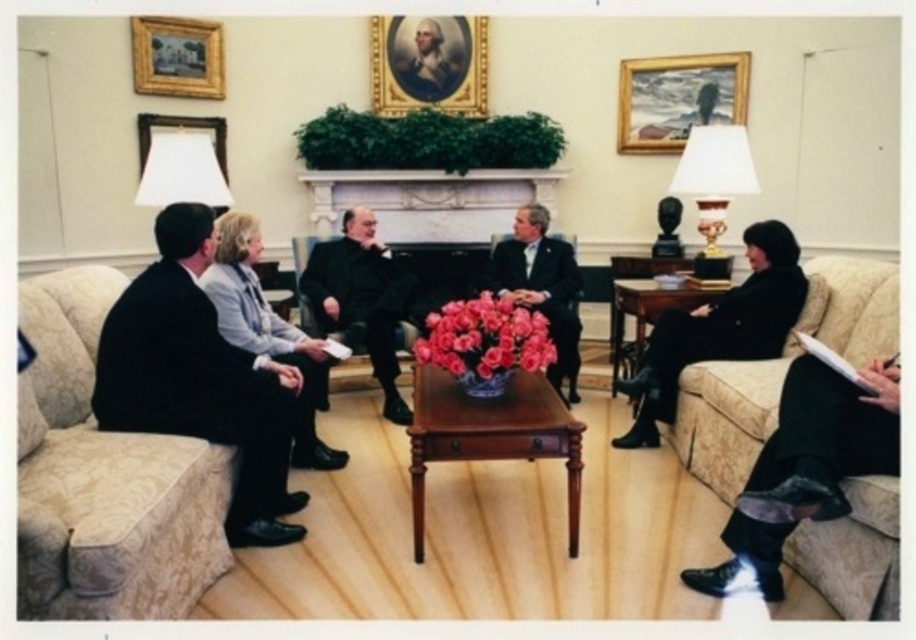
Question: From the image, what is the correct spatial relationship of beige fabric couch at left in relation to velvet beige couch at right?

Choices:
 (A) below
 (B) above

Answer: (A)

Question: Which object is closer to the camera taking this photo?

Choices:
 (A) velvet beige couch at right
 (B) matte black suit at center
 (C) wooden coffee table at center

Answer: (A)

Question: Which object is the farthest from the beige fabric couch at left?

Choices:
 (A) mahogany wooden table at center
 (B) velvet beige couch at right

Answer: (B)

Question: Does velvet beige couch at right have a larger size compared to dark wool suit at center?

Choices:
 (A) yes
 (B) no

Answer: (A)

Question: Can you confirm if velvet beige couch at right is wider than wooden coffee table at center?

Choices:
 (A) yes
 (B) no

Answer: (A)

Question: Which of the following is the farthest from the observer?

Choices:
 (A) wooden coffee table at center
 (B) mahogany wooden table at center
 (C) matte black suit at center

Answer: (C)